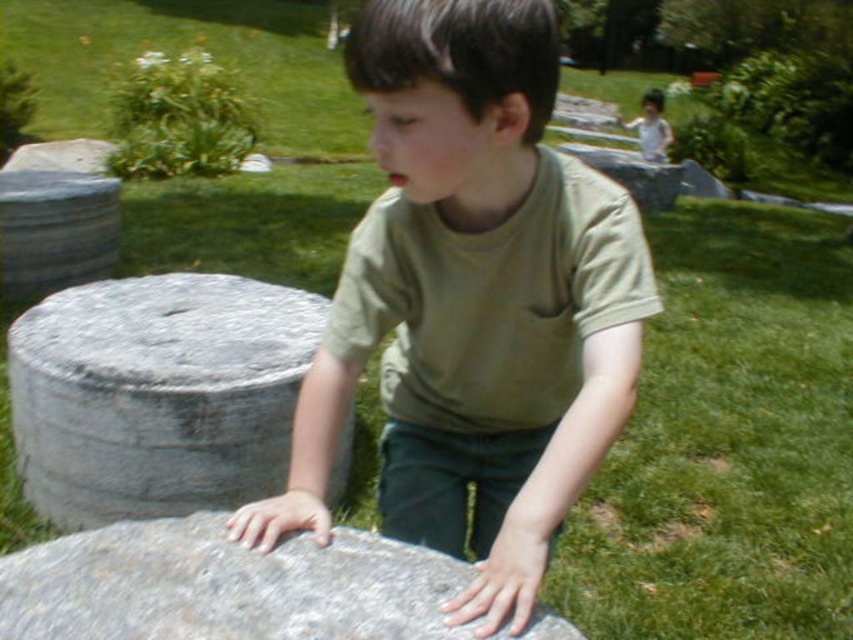
Question: Is gray rough stone at left to the right of gray rough stone at lower left from the viewer's perspective?

Choices:
 (A) no
 (B) yes

Answer: (A)

Question: Is gray rough stone at left behind gray stone at left?

Choices:
 (A) yes
 (B) no

Answer: (B)

Question: Which point is closer to the camera taking this photo?

Choices:
 (A) (281, 362)
 (B) (625, 200)
 (C) (90, 212)

Answer: (B)

Question: Which point is farther to the camera?

Choices:
 (A) white matte shirt at upper center
 (B) gray rough stone at lower left
 (C) gray stone at left

Answer: (A)

Question: Can you confirm if gray rough stone at left is wider than gray stone at left?

Choices:
 (A) yes
 (B) no

Answer: (A)

Question: Which object is farther from the camera taking this photo?

Choices:
 (A) white matte shirt at upper center
 (B) gray rough stone at lower left
 (C) green matte shirt at center

Answer: (A)